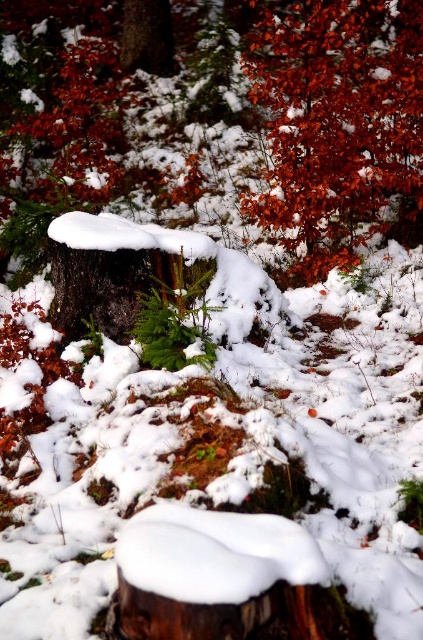
Who is more distant from viewer, (316, 108) or (140, 353)?

The point (316, 108) is behind.

Does shiny red leaves at upper right have a greater height compared to green matte fern at center?

Yes, shiny red leaves at upper right is taller than green matte fern at center.

Find the location of `shiny red leaves at upper right`. shiny red leaves at upper right is located at coordinates (337, 122).

Where is `shiny red leaves at upper right`? The width and height of the screenshot is (423, 640). shiny red leaves at upper right is located at coordinates (337, 122).